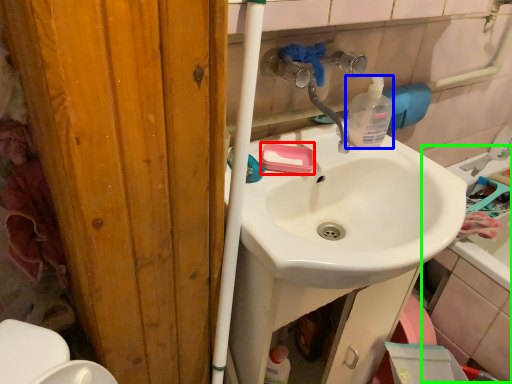
Question: Which object is the closest to the soap (highlighted by a red box)? Choose among these: bottle (highlighted by a blue box) or bath (highlighted by a green box).

Choices:
 (A) bottle
 (B) bath

Answer: (A)